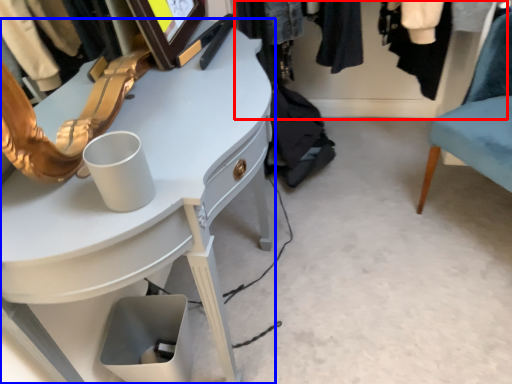
Question: Which object appears farthest to the camera in this image, closet (highlighted by a red box) or desk (highlighted by a blue box)?

Choices:
 (A) closet
 (B) desk

Answer: (A)